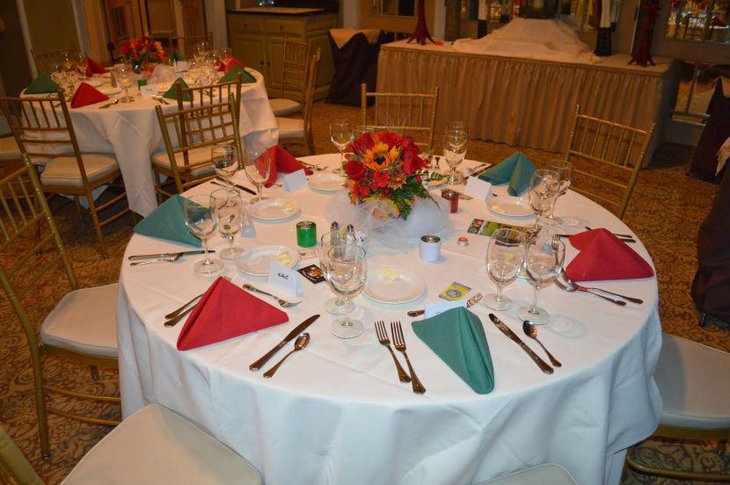
You are a GUI agent. You are given a task and a screenshot of the screen. Output one action in this format:
    pyautogui.click(x=<x>, y=<y>)
    Task: Click on the spoon
    The image size is (730, 485).
    Given the screenshot: What is the action you would take?
    tap(288, 357)